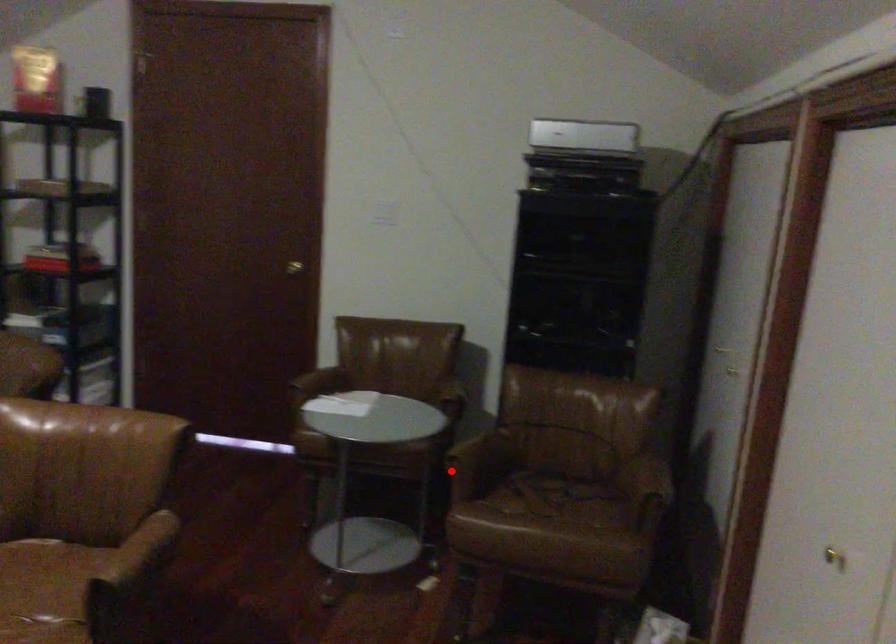
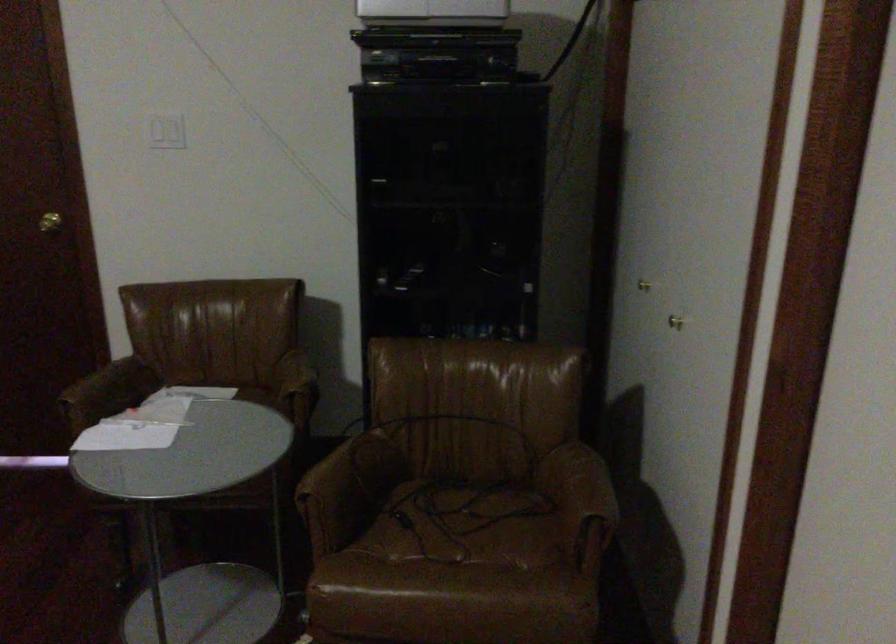
Locate, in the second image, the point that corresponds to the highlighted location in the first image.

(312, 513)